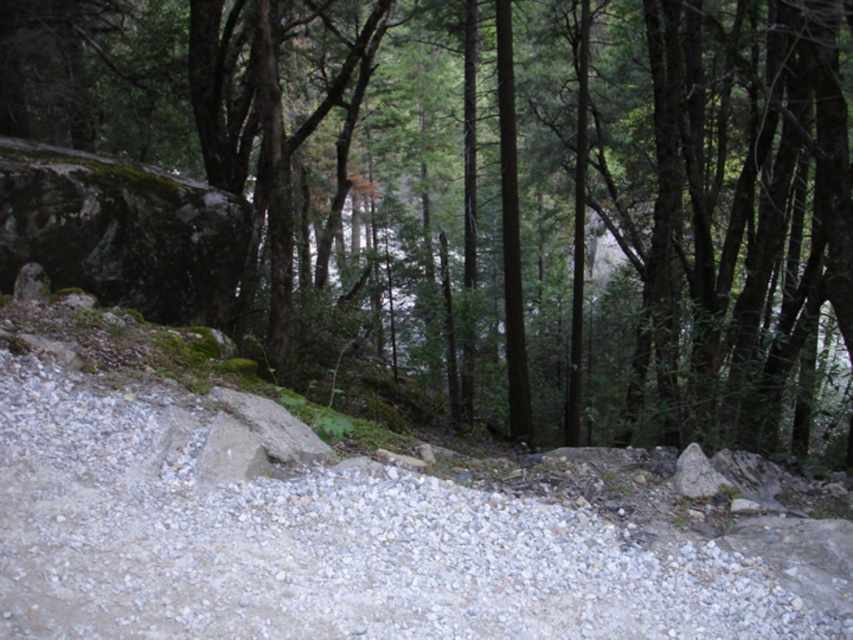
You are a hiker standing on the gray gravel path at center. You want to take a photo of the green leafy tree at center. Which object should you focus on to ensure the tree is in the foreground of your photo?

To ensure the green leafy tree at center is in the foreground of your photo, you should focus on the green leafy tree at center since it is taller than the gray gravel path at center, making it stand out in front.

You are hiking along the gray gravel path at center and want to reach the green leafy tree at center. Which direction should you turn to head towards it?

You should turn to your right because the green leafy tree at center is located to the right of the gray gravel path at center.